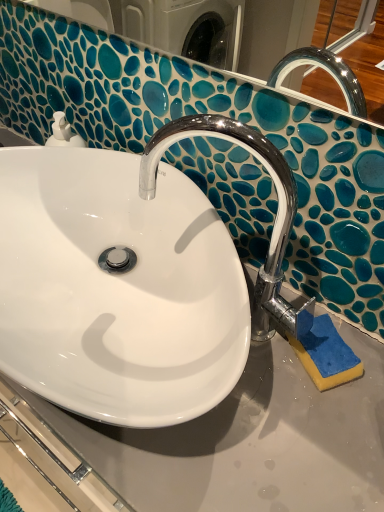
Locate an element on the screen. free location in front of chrome/metallic faucet at center is located at coordinates (278, 444).